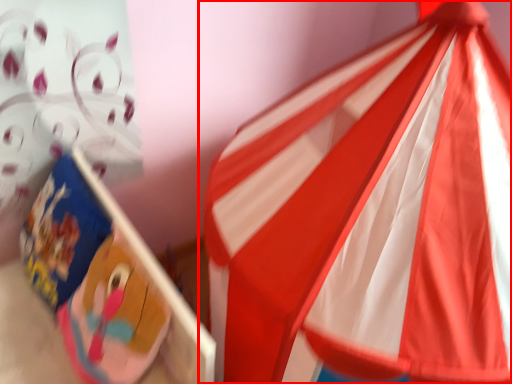
Question: From the image's perspective, considering the relative positions of flag (annotated by the red box) and cardboard box in the image provided, where is flag (annotated by the red box) located with respect to the staircase?

Choices:
 (A) above
 (B) below

Answer: (A)